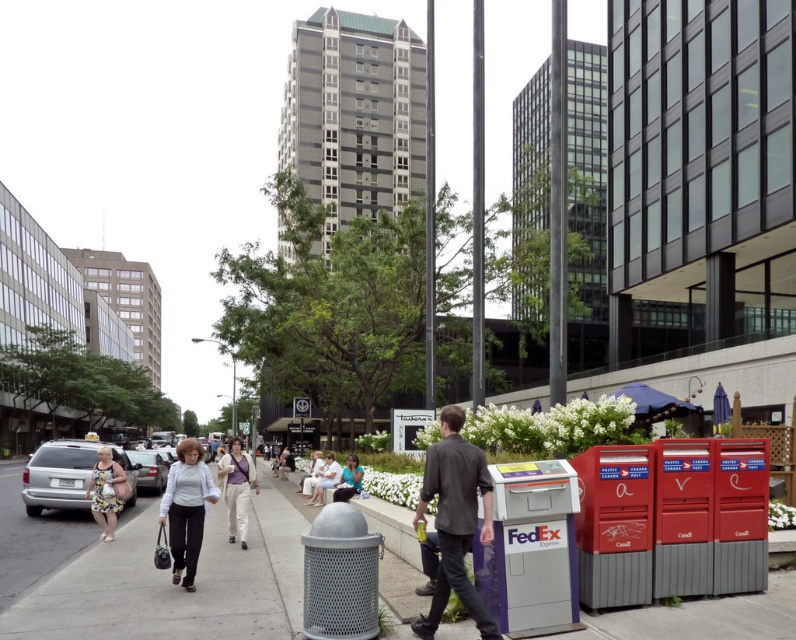
You are a delivery person standing at the FedEx logo postal box on the sidewalk. You need to deliver a package to a person wearing the dark gray textured blazer at center and the light gray fabric pants at lower left. Can you deliver the package to both people at the same time without moving from your current position?

The dark gray textured blazer at center and light gray fabric pants at lower left are 4.78 meters apart from each other. Since they are more than 4 meters apart, you cannot deliver the package to both people at the same time without moving from your current position.

You are a fashion designer observing a person wearing a dark gray textured blazer at center and light gray fabric pants at lower left. Which clothing item takes up more space on the person?

The light gray fabric pants at lower left takes up more space on the person than the dark gray textured blazer at center.

You are standing on the sidewalk in the urban street scene. There are two points marked on the ground at coordinates point (x=102, y=531) and point (x=322, y=488). If you face the direction you are walking, which point would be closer to your current position?

Point (x=102, y=531) is in front of point (x=322, y=488), so if you are facing the direction you are walking, the point (x=102, y=531) would be closer to your current position.